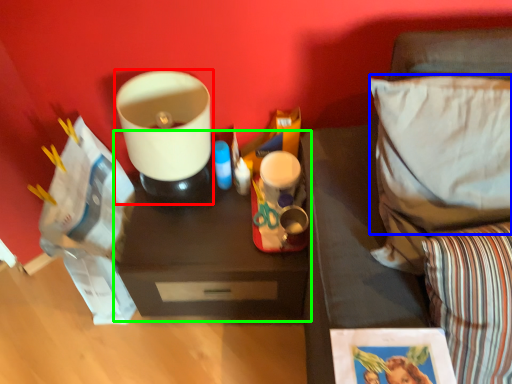
Question: Estimate the real-world distances between objects in this image. Which object is farther from appliance (highlighted by a red box), pillow (highlighted by a blue box) or table (highlighted by a green box)?

Choices:
 (A) pillow
 (B) table

Answer: (A)